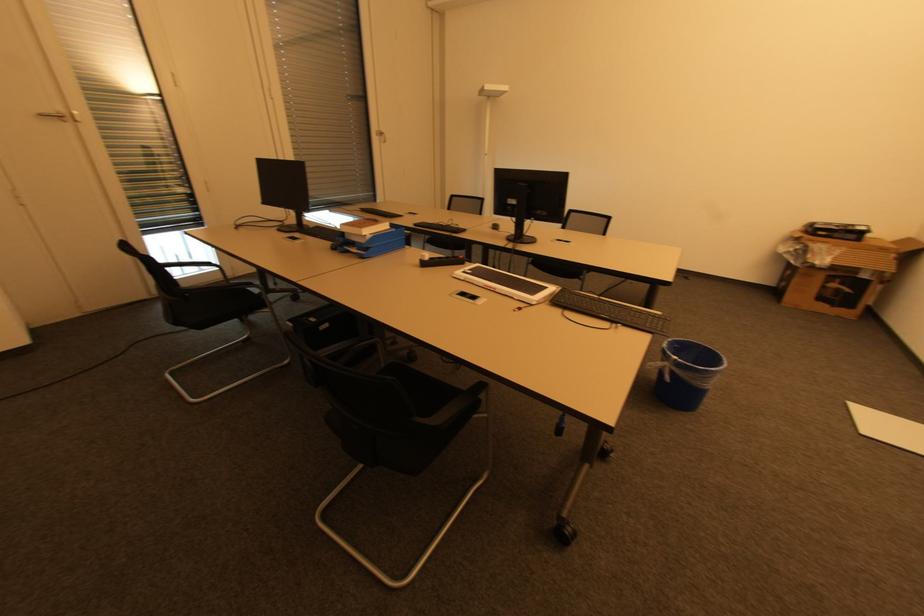
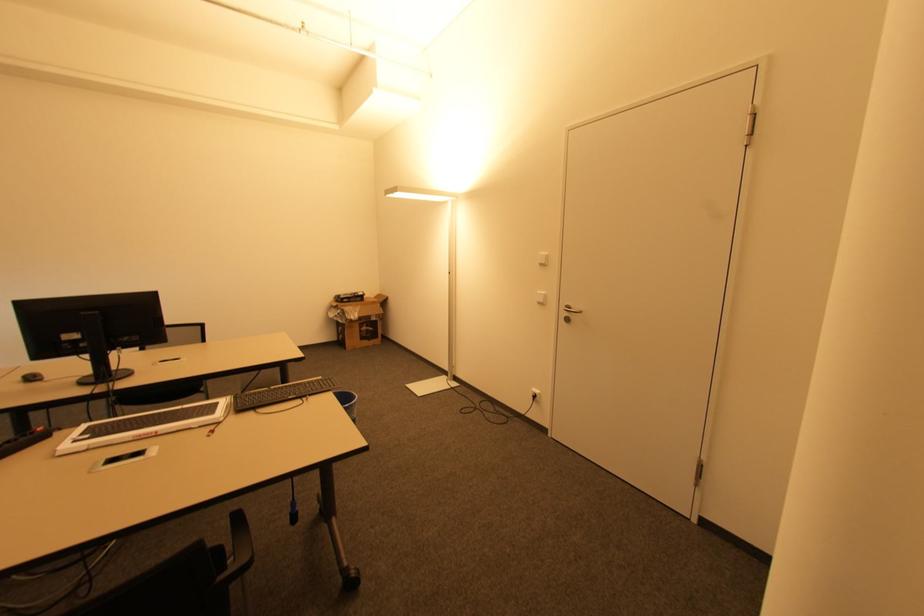
Where in the second image is the point corresponding to the point at 493,225 from the first image?

(21, 379)